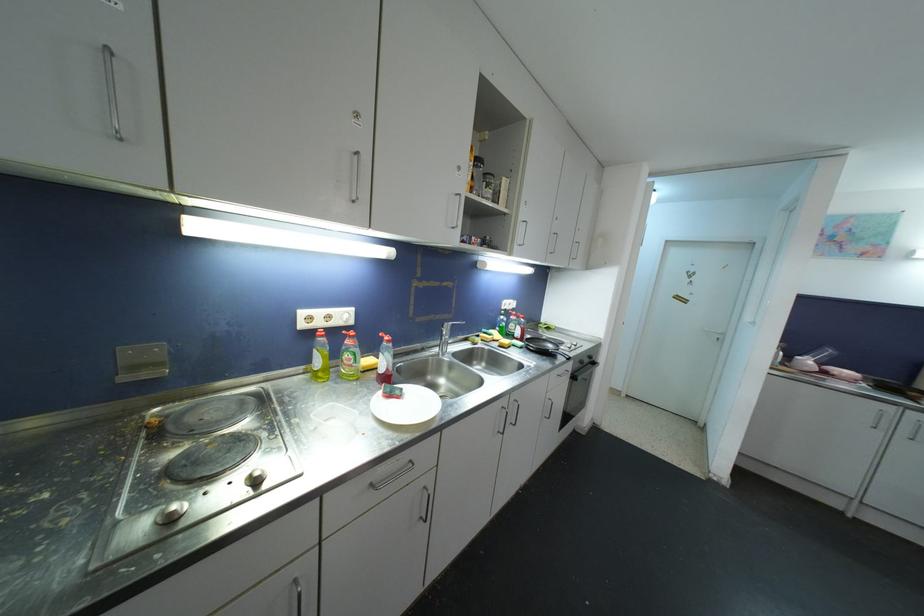
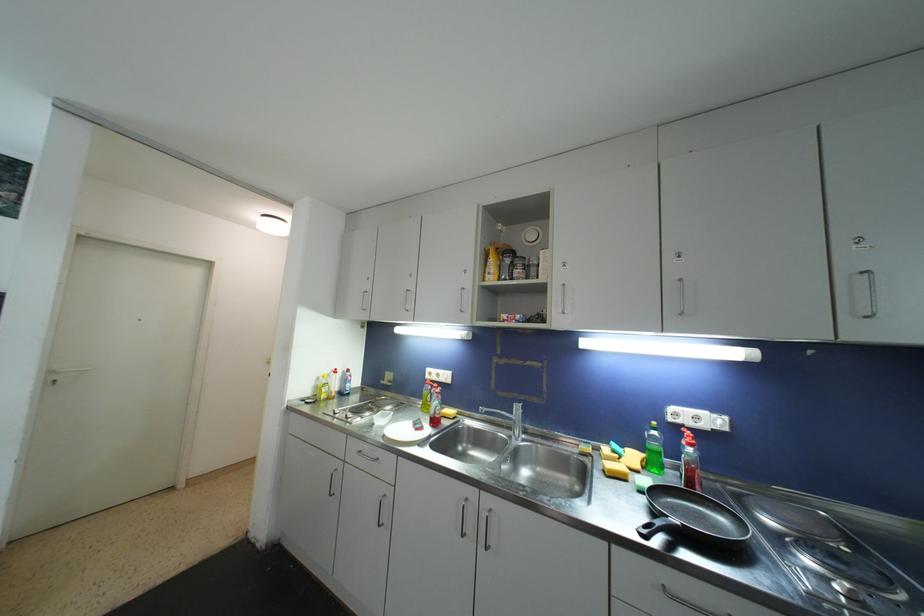
Where in the second image is the point corresponding to (x=503, y=350) from the first image?

(608, 474)